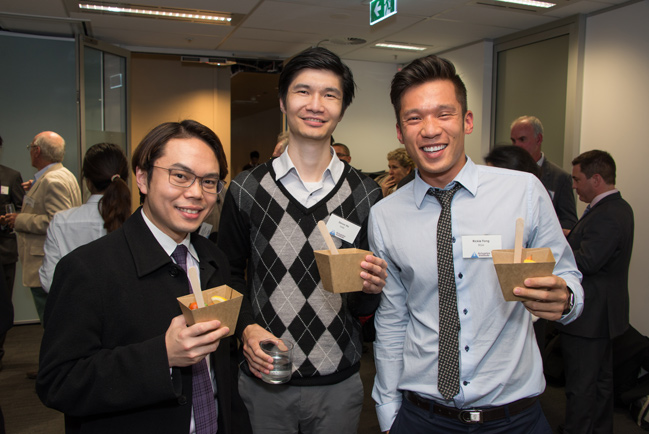
Image resolution: width=649 pixels, height=434 pixels. In order to click on exit sign in this screenshot , I will do `click(369, 13)`.